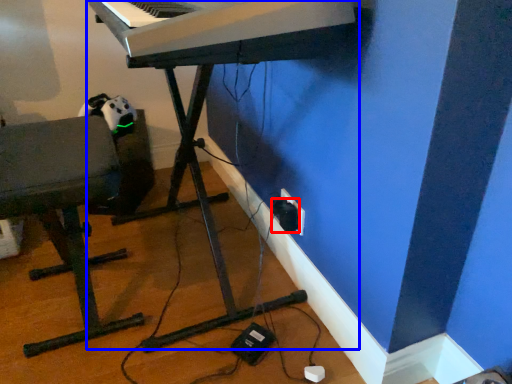
Question: Which of the following is the closest to the observer, plug (highlighted by a red box) or piano (highlighted by a blue box)?

Choices:
 (A) plug
 (B) piano

Answer: (B)